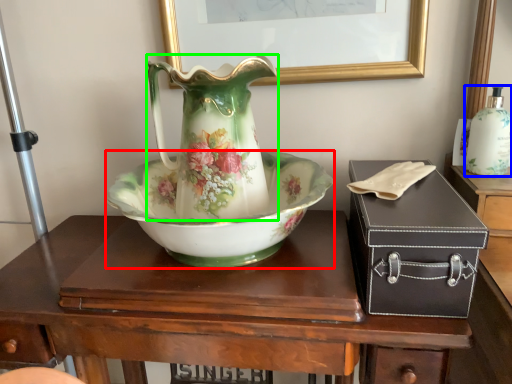
Question: Considering the real-world distances, which object is farthest from bowl (highlighted by a red box)? bottle (highlighted by a blue box) or vase (highlighted by a green box)?

Choices:
 (A) bottle
 (B) vase

Answer: (A)